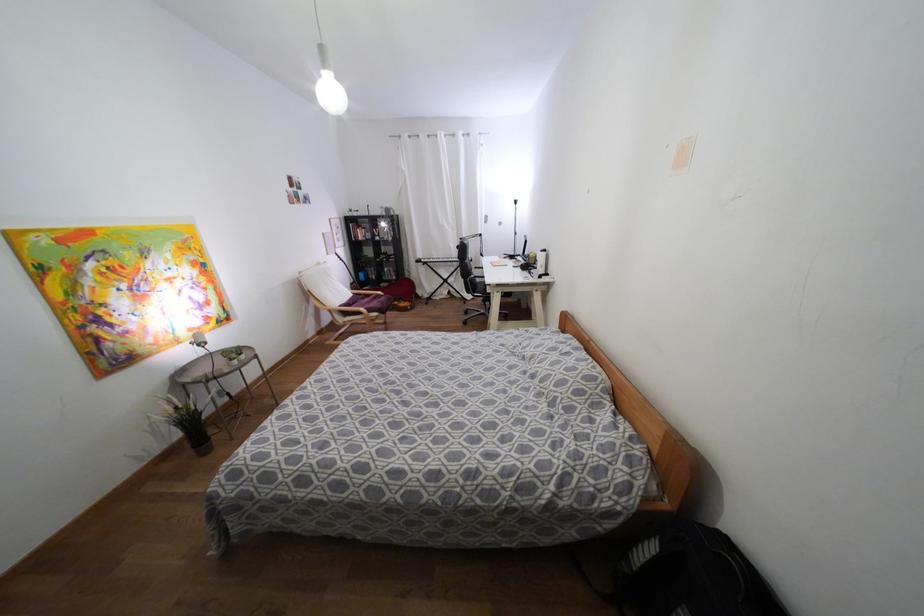
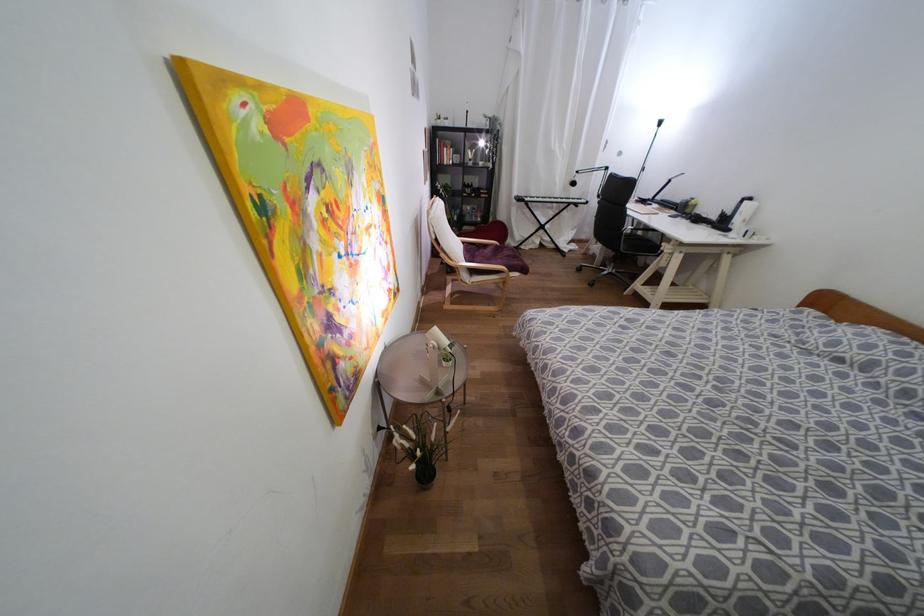
In the second image, find the point that corresponds to (383,224) in the first image.

(480, 143)